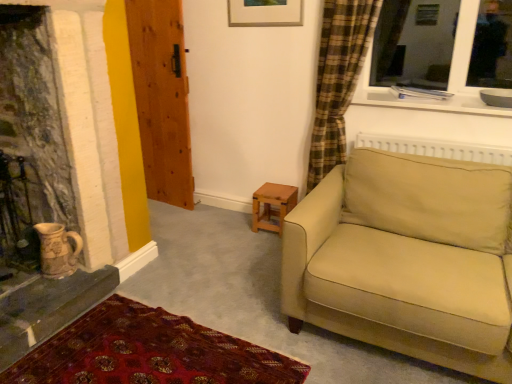
Question: Should I look upward or downward to see wooden table at center?

Choices:
 (A) up
 (B) down

Answer: (B)

Question: Can you confirm if wooden door at left is thinner than carpet with intricate patterns at lower left?

Choices:
 (A) no
 (B) yes

Answer: (B)

Question: Does wooden door at left turn towards carpet with intricate patterns at lower left?

Choices:
 (A) no
 (B) yes

Answer: (A)

Question: Can you confirm if wooden door at left is taller than carpet with intricate patterns at lower left?

Choices:
 (A) yes
 (B) no

Answer: (A)

Question: Can you see wooden door at left touching carpet with intricate patterns at lower left?

Choices:
 (A) no
 (B) yes

Answer: (A)

Question: From a real-world perspective, is wooden door at left physically above carpet with intricate patterns at lower left?

Choices:
 (A) no
 (B) yes

Answer: (B)

Question: From a real-world perspective, does wooden door at left sit lower than carpet with intricate patterns at lower left?

Choices:
 (A) yes
 (B) no

Answer: (B)

Question: Considering the relative sizes of beige fabric couch at right and wooden door at left in the image provided, is beige fabric couch at right bigger than wooden door at left?

Choices:
 (A) yes
 (B) no

Answer: (A)

Question: Is beige fabric couch at right not near wooden door at left?

Choices:
 (A) yes
 (B) no

Answer: (A)

Question: Is the surface of beige fabric couch at right in direct contact with wooden door at left?

Choices:
 (A) no
 (B) yes

Answer: (A)

Question: Is beige fabric couch at right outside of wooden door at left?

Choices:
 (A) no
 (B) yes

Answer: (B)

Question: Could you tell me if beige fabric couch at right is turned towards wooden door at left?

Choices:
 (A) yes
 (B) no

Answer: (B)

Question: Is beige fabric couch at right turned away from wooden door at left?

Choices:
 (A) yes
 (B) no

Answer: (B)

Question: Is beige fabric couch at right beside wooden table at center?

Choices:
 (A) no
 (B) yes

Answer: (A)